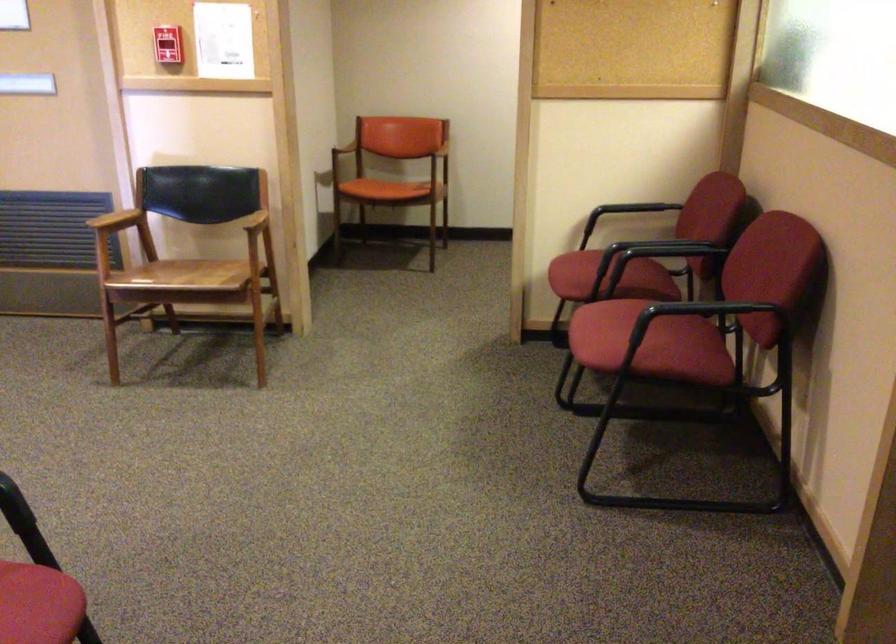
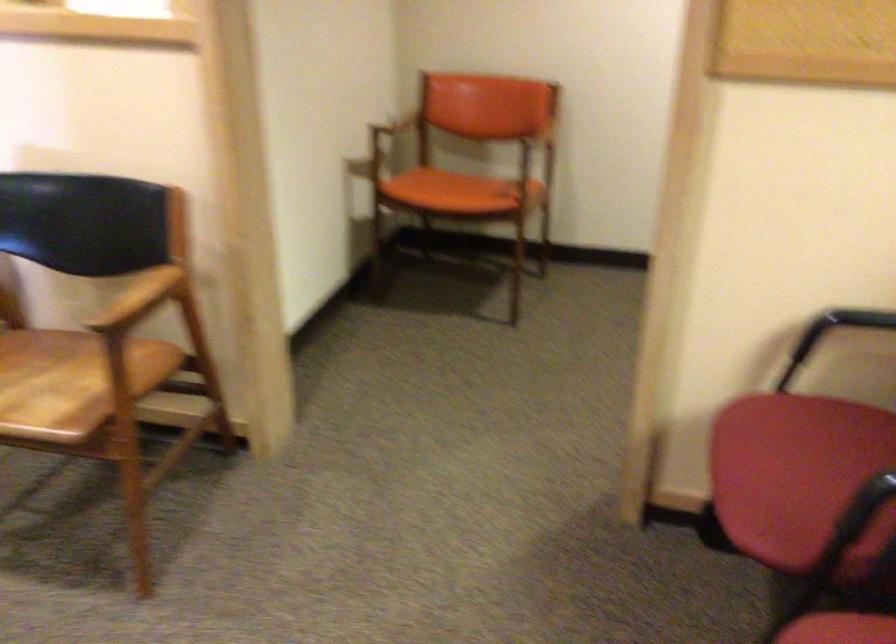
Find the pixel in the second image that matches pixel 442 149 in the first image.

(536, 146)